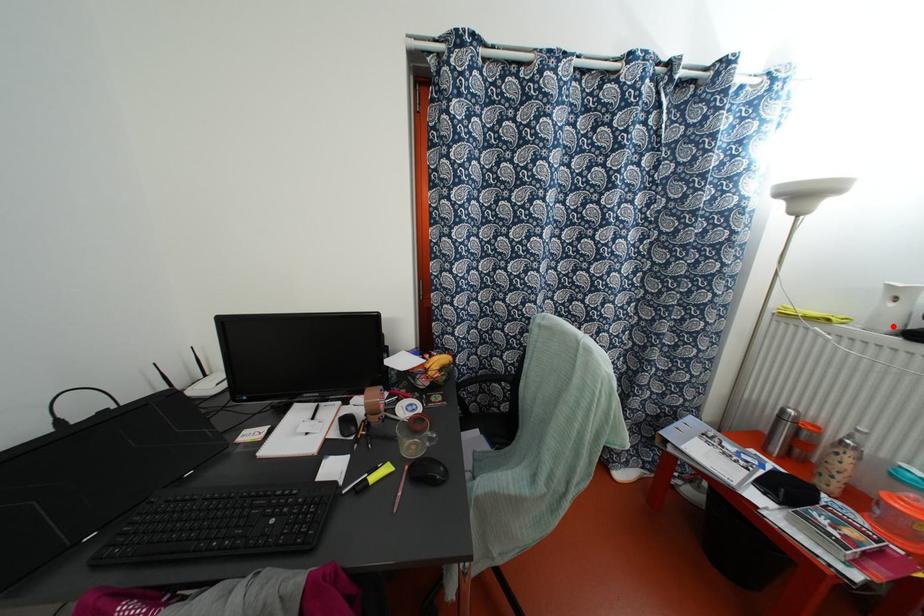
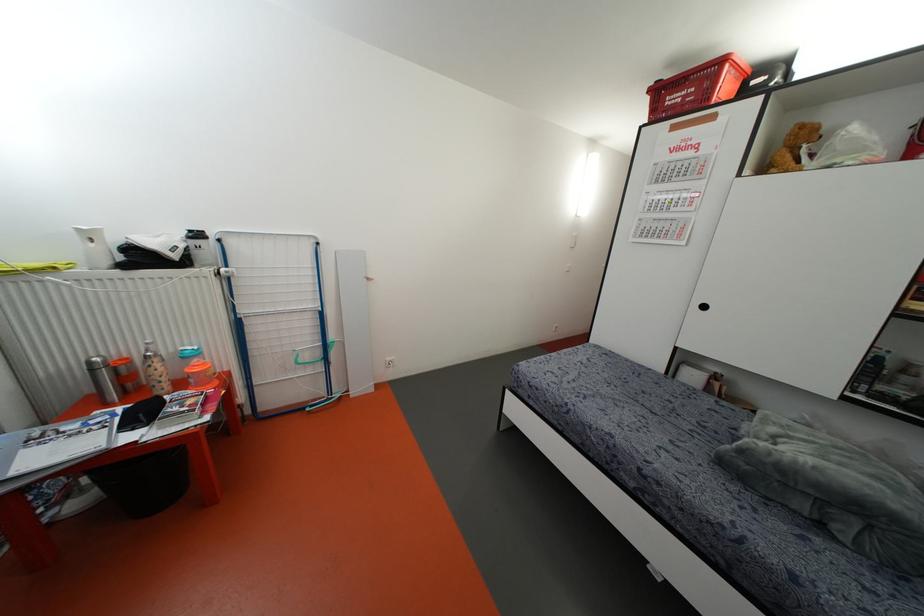
Locate, in the second image, the point that corresponds to the highlighted location in the first image.

(107, 262)